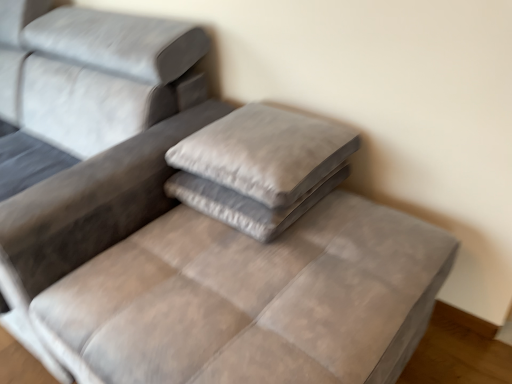
Question: Considering the relative positions of suede gray pillow at center, placed as the second pillow when sorted from bottom to top, and velvet gray mattress at center in the image provided, is suede gray pillow at center, placed as the second pillow when sorted from bottom to top, behind velvet gray mattress at center?

Choices:
 (A) no
 (B) yes

Answer: (B)

Question: Is suede gray pillow at center, placed as the second pillow when sorted from bottom to top, oriented away from velvet gray mattress at center?

Choices:
 (A) yes
 (B) no

Answer: (B)

Question: Is the depth of suede gray pillow at center, which is counted as the first pillow, starting from the top, less than that of velvet gray mattress at center?

Choices:
 (A) no
 (B) yes

Answer: (A)

Question: Is suede gray pillow at center, placed as the second pillow when sorted from bottom to top, far away from velvet gray mattress at center?

Choices:
 (A) yes
 (B) no

Answer: (B)

Question: Does suede gray pillow at center, which is counted as the first pillow, starting from the top, have a greater width compared to velvet gray mattress at center?

Choices:
 (A) no
 (B) yes

Answer: (A)

Question: Is suede gray pillow at center, which is counted as the first pillow, starting from the top, taller than velvet gray mattress at center?

Choices:
 (A) yes
 (B) no

Answer: (B)

Question: Considering the relative positions of velvet gray pillow at center, the 2th pillow viewed from the top, and velvet gray mattress at center in the image provided, is velvet gray pillow at center, the 2th pillow viewed from the top, to the right of velvet gray mattress at center from the viewer's perspective?

Choices:
 (A) no
 (B) yes

Answer: (B)

Question: Can you confirm if velvet gray pillow at center, which appears as the first pillow when ordered from the bottom, is taller than velvet gray mattress at center?

Choices:
 (A) yes
 (B) no

Answer: (B)

Question: Is velvet gray pillow at center, the 2th pillow viewed from the top, aimed at velvet gray mattress at center?

Choices:
 (A) no
 (B) yes

Answer: (A)

Question: Is velvet gray pillow at center, the 2th pillow viewed from the top, in front of velvet gray mattress at center?

Choices:
 (A) no
 (B) yes

Answer: (A)

Question: Is velvet gray pillow at center, the 2th pillow viewed from the top, thinner than velvet gray mattress at center?

Choices:
 (A) yes
 (B) no

Answer: (A)

Question: Is velvet gray pillow at center, the 2th pillow viewed from the top, to the left of velvet gray mattress at center from the viewer's perspective?

Choices:
 (A) no
 (B) yes

Answer: (A)

Question: Does velvet gray mattress at center have a greater height compared to suede gray pillow at center, placed as the second pillow when sorted from bottom to top?

Choices:
 (A) yes
 (B) no

Answer: (A)